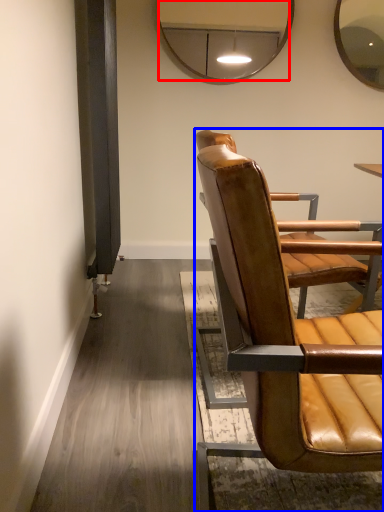
Question: Which of the following is the farthest to the observer, mirror (highlighted by a red box) or chair (highlighted by a blue box)?

Choices:
 (A) mirror
 (B) chair

Answer: (A)